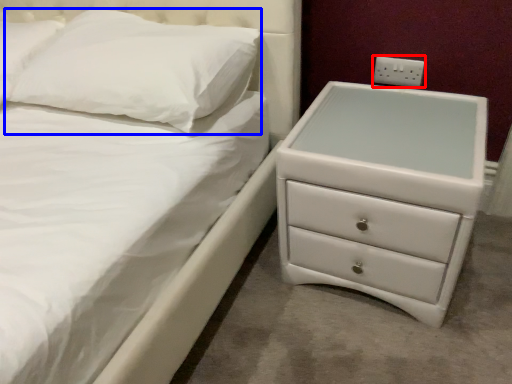
Question: Which object appears closest to the camera in this image, electric outlet (highlighted by a red box) or pillow (highlighted by a blue box)?

Choices:
 (A) electric outlet
 (B) pillow

Answer: (B)